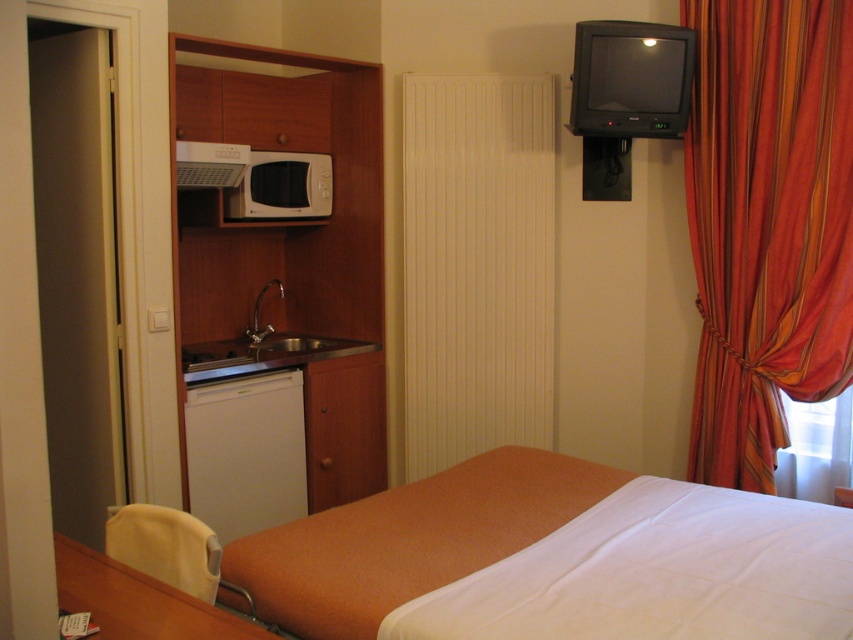
Which is in front, point (589, 468) or point (250, 349)?

Point (589, 468) is in front.

Which of these two, orange fabric bed at center or stainless steel sink at center, stands shorter?

orange fabric bed at center is shorter.

In order to click on orange fabric bed at center in this screenshot , I will do `click(554, 560)`.

Between orange striped fabric at right and white matte dishwasher at lower left, which one appears on the left side from the viewer's perspective?

white matte dishwasher at lower left is more to the left.

Between orange striped fabric at right and white matte dishwasher at lower left, which one is positioned lower?

white matte dishwasher at lower left is below.

Identify the location of orange striped fabric at right. (767, 224).

Between orange fabric bed at center and white matte microwave at upper left, which one is positioned higher?

Positioned higher is white matte microwave at upper left.

Between point (310, 529) and point (215, 170), which one is positioned in front?

Point (310, 529) is in front.

Where is `orange fabric bed at center`? orange fabric bed at center is located at coordinates (554, 560).